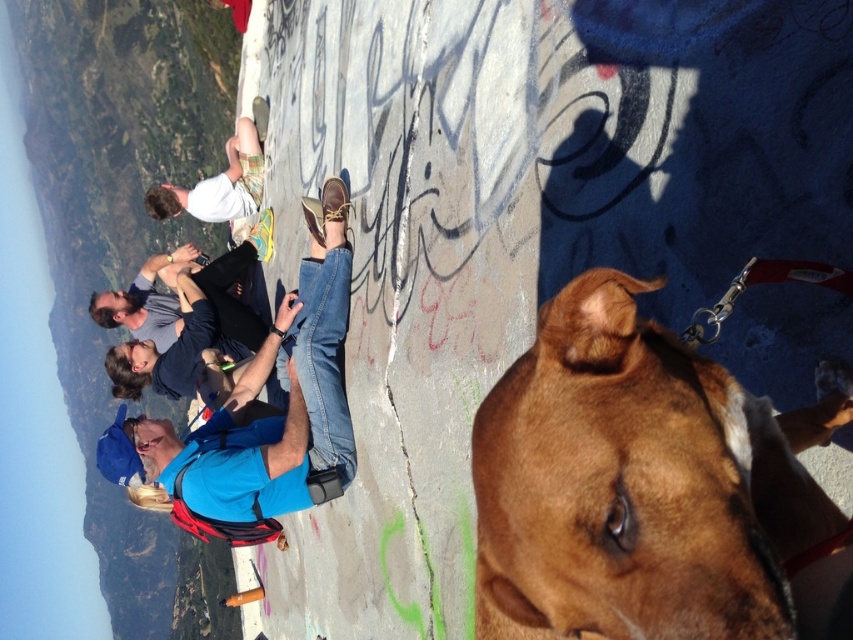
Question: Observing the image, what is the correct spatial positioning of brown smooth dog at center in reference to blue fabric shirt at center?

Choices:
 (A) below
 (B) above

Answer: (B)

Question: Does brown smooth dog at center appear on the right side of white cotton shirt at upper center?

Choices:
 (A) no
 (B) yes

Answer: (B)

Question: Which object appears farthest from the camera in this image?

Choices:
 (A) white cotton shirt at upper center
 (B) blue fabric shirt at center

Answer: (A)

Question: Is blue fabric shirt at center to the right of white cotton shirt at upper center from the viewer's perspective?

Choices:
 (A) no
 (B) yes

Answer: (B)

Question: Which point is closer to the camera?

Choices:
 (A) (230, 147)
 (B) (734, 545)

Answer: (B)

Question: Estimate the real-world distances between objects in this image. Which object is farther from the white cotton shirt at upper center?

Choices:
 (A) brown smooth dog at center
 (B) blue fabric shirt at center

Answer: (A)